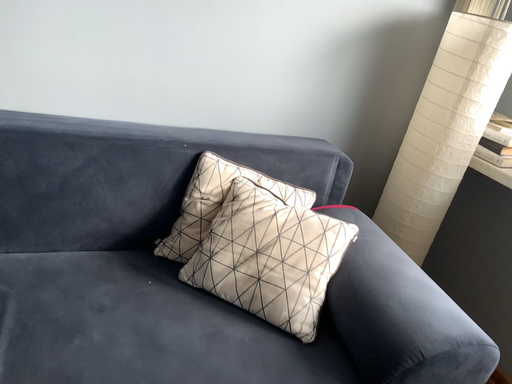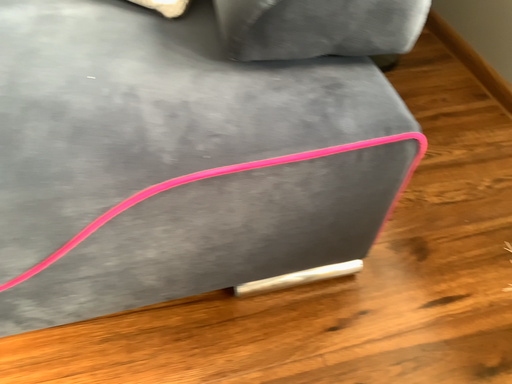
Question: How did the camera likely rotate when shooting the video?

Choices:
 (A) rotated left
 (B) rotated right

Answer: (A)